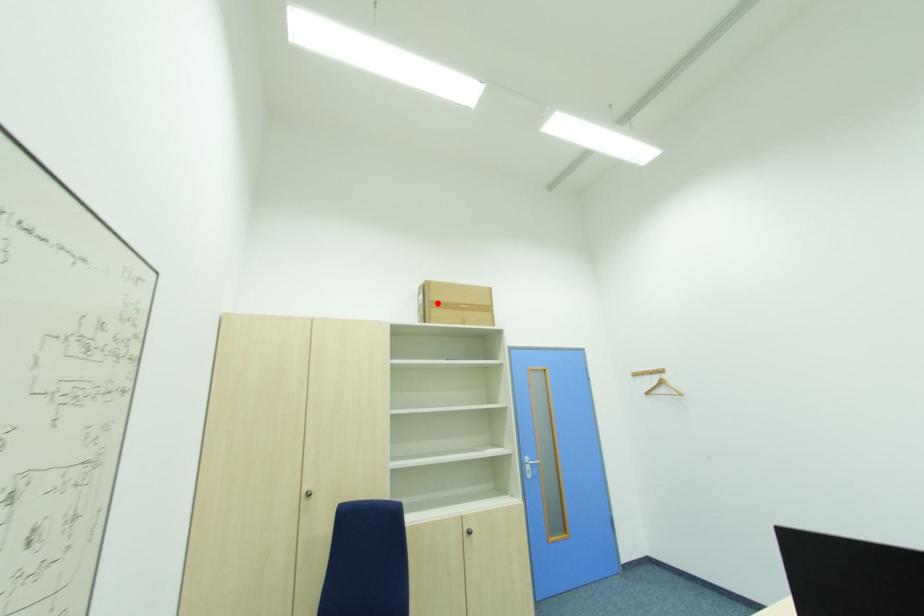
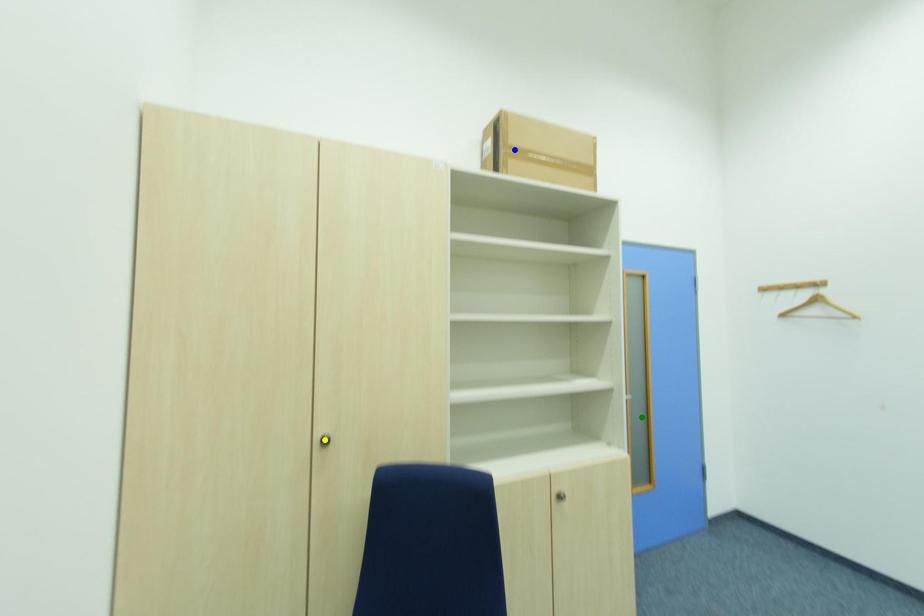
Question: I am providing you with two images of the same scene from different viewpoints. A red point is marked on the first image. You are given multiple points on the second image. Which mark in image 2 goes with the point in image 1?

Choices:
 (A) green point
 (B) blue point
 (C) yellow point

Answer: (B)